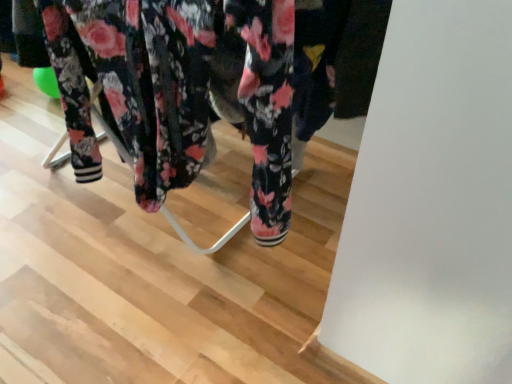
Identify the location of vacant area situated below metallic white rack at center (from a real-world perspective). This screenshot has width=512, height=384. (115, 230).